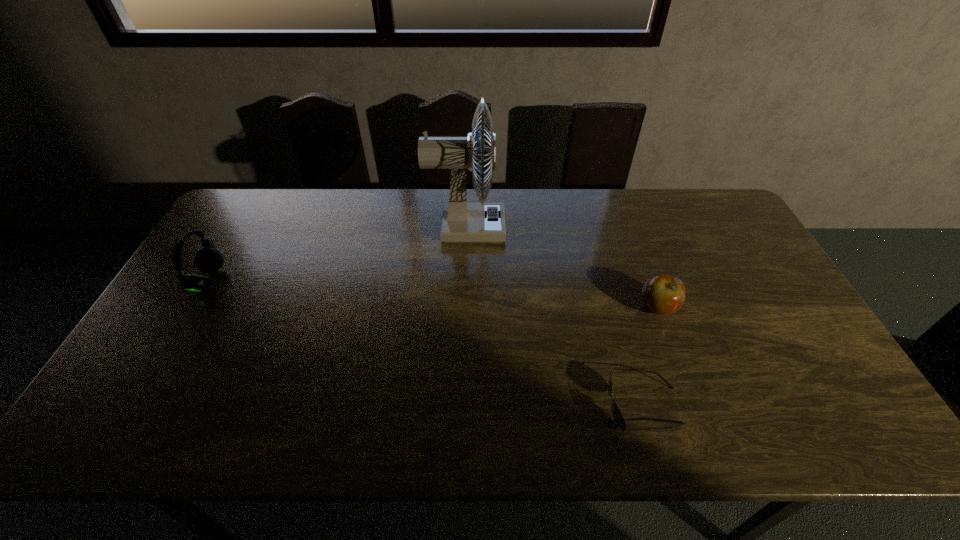
Locate which object is the closest to the sunglasses. Please provide its 2D coordinates. Your answer should be formatted as a tuple, i.e. [(x, y)], where the tuple contains the x and y coordinates of a point satisfying the conditions above.

[(663, 294)]

Identify the location of object that is the closest to the farthest object. (663, 294).

Identify the location of blank space that satisfies the following two spatial constraints: 1. on the front-facing side of the farthest object; 2. on the right side of the apple. (464, 308).

Where is `free space that satisfies the following two spatial constraints: 1. on the ear cups of the headset; 2. on the left side of the second shortest object`? This screenshot has width=960, height=540. free space that satisfies the following two spatial constraints: 1. on the ear cups of the headset; 2. on the left side of the second shortest object is located at coordinates (192, 308).

Find the location of a particular element. This screenshot has width=960, height=540. blank area in the image that satisfies the following two spatial constraints: 1. on the back side of the second shortest object; 2. on the ear cups of the leftmost object is located at coordinates (647, 280).